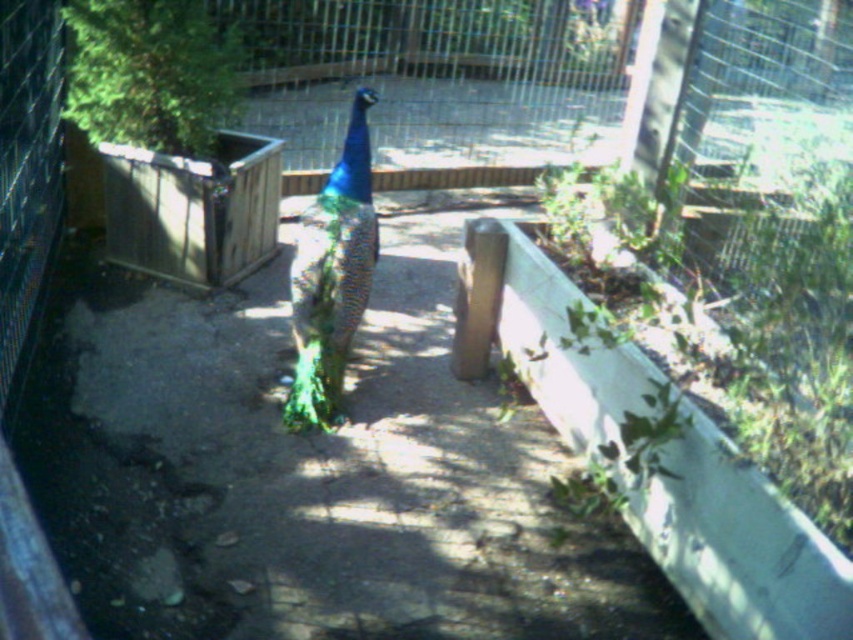
You are a zookeeper observing the green iridescent peacock at center and the shiny iridescent peacock at center in the enclosure. Which peacock is located more to the left?

The green iridescent peacock at center is positioned on the left side of the shiny iridescent peacock at center, so it is more to the left.

You are standing in front of the peacock enclosure and notice two points marked in the scene. The first point is at coordinate point[538,444] and the second is at point[128,28]. Which point is closer to you?

Point[538,444] is closer to the viewer than point[128,28].